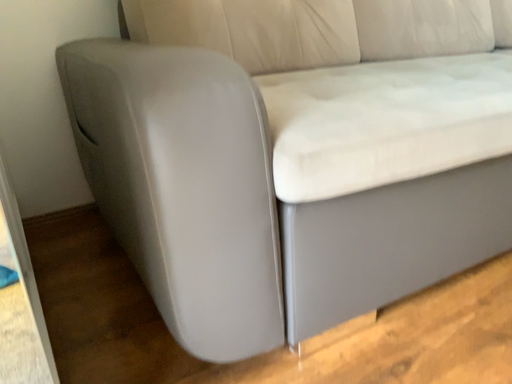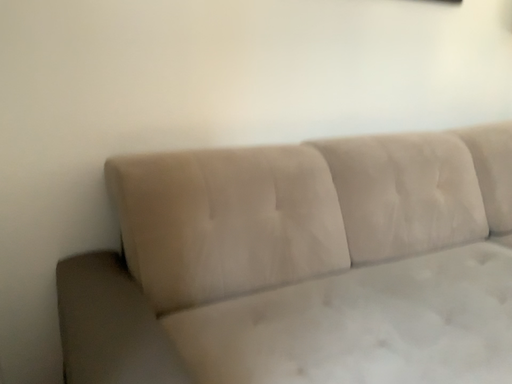
Question: Which way did the camera rotate in the video?

Choices:
 (A) rotated downward
 (B) rotated upward

Answer: (B)